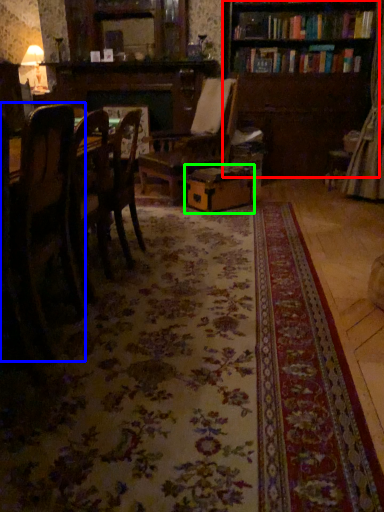
Question: Estimate the real-world distances between objects in this image. Which object is closer to bookcase (highlighted by a red box), chair (highlighted by a blue box) or cardboard box (highlighted by a green box)?

Choices:
 (A) chair
 (B) cardboard box

Answer: (B)